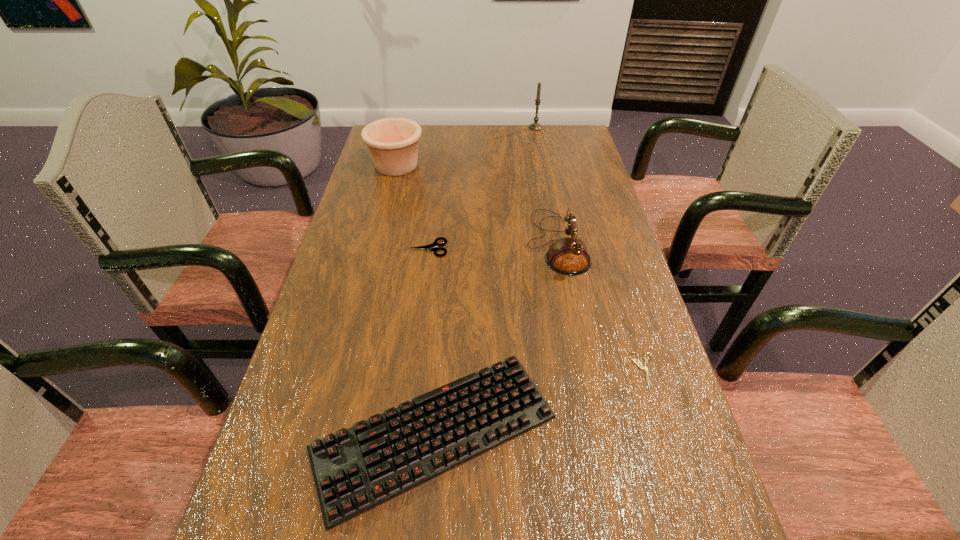
The height and width of the screenshot is (540, 960). I want to click on the farthest object, so click(535, 126).

The width and height of the screenshot is (960, 540). Find the location of `the tallest object`. the tallest object is located at coordinates (535, 126).

Where is `pottery`? pottery is located at coordinates (392, 142).

Where is `telephone`? The height and width of the screenshot is (540, 960). telephone is located at coordinates click(x=569, y=256).

Locate an element on the screen. the fourth tallest object is located at coordinates (356, 469).

You are a GUI agent. You are given a task and a screenshot of the screen. Output one action in this format:
    pyautogui.click(x=<x>, y=<y>)
    Task: Click on the tallest shears
    Image resolution: width=960 pixels, height=540 pixels.
    Given the screenshot: What is the action you would take?
    pyautogui.click(x=432, y=247)

The image size is (960, 540). What are the coordinates of `the third shortest object` in the screenshot? It's located at (432, 247).

Image resolution: width=960 pixels, height=540 pixels. I want to click on the second nearest shears, so click(634, 361).

Where is `the second tallest shears`? Image resolution: width=960 pixels, height=540 pixels. the second tallest shears is located at coordinates (634, 361).

Identify the location of blank space located 0.180m on the left of the candle. The image size is (960, 540). (480, 127).